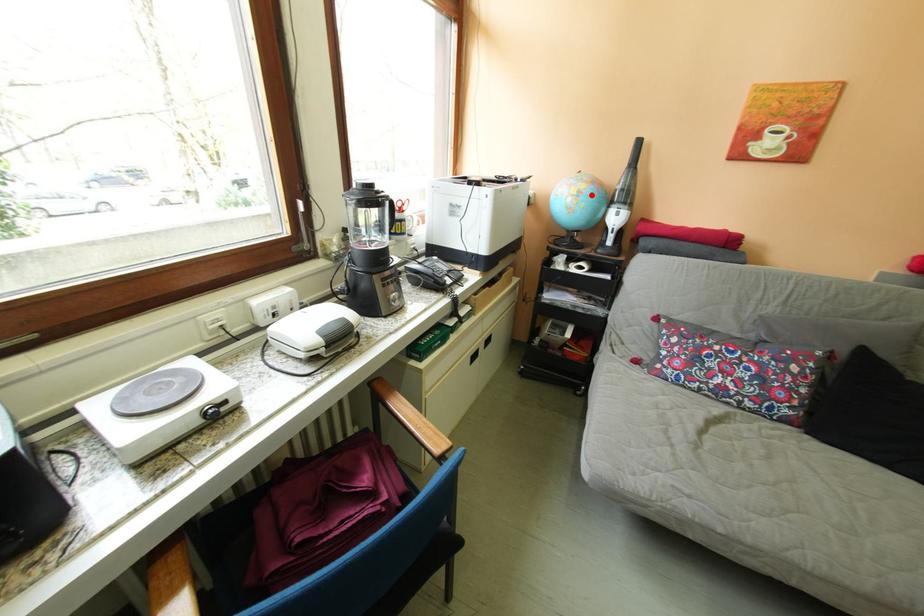
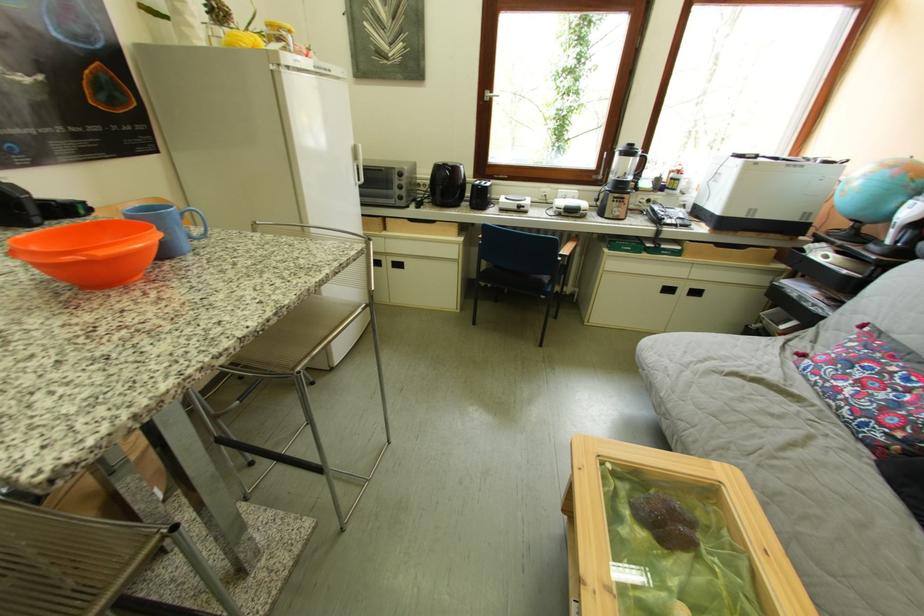
Question: I am providing you with two images of the same scene from different viewpoints. A red point is shown in image1. For the corresponding object point in image2, is it positioned nearer or farther from the camera?

Choices:
 (A) Nearer
 (B) Farther

Answer: (B)